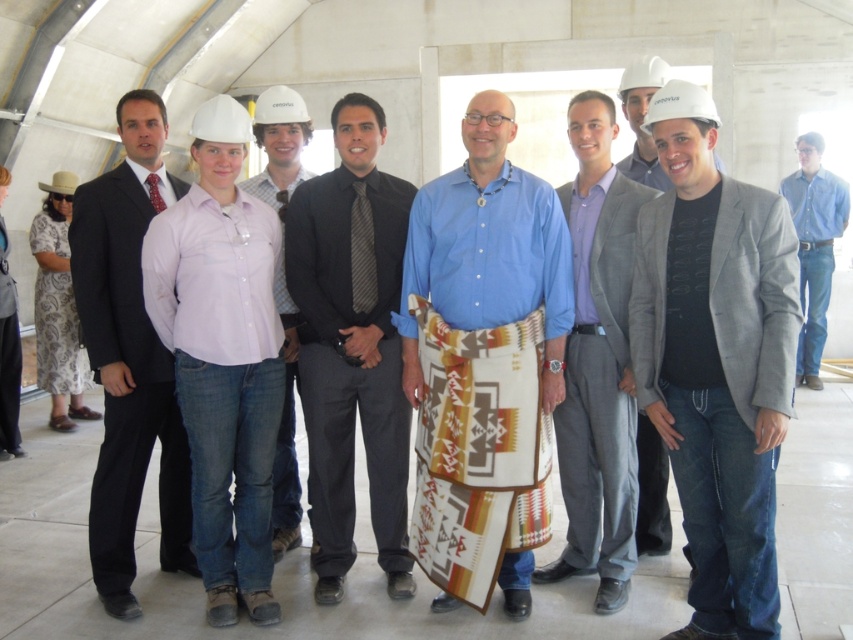
You are an architect at the construction site. You need to hang a decorative item that requires a support beam wider than the gray wool suit at center. Can the gray fabric at center provide enough width for this purpose?

The gray fabric at center might be wider than gray wool suit at center, so it could potentially provide sufficient width for the decorative item if the fabric is indeed wider. Verify the actual measurements before proceeding.